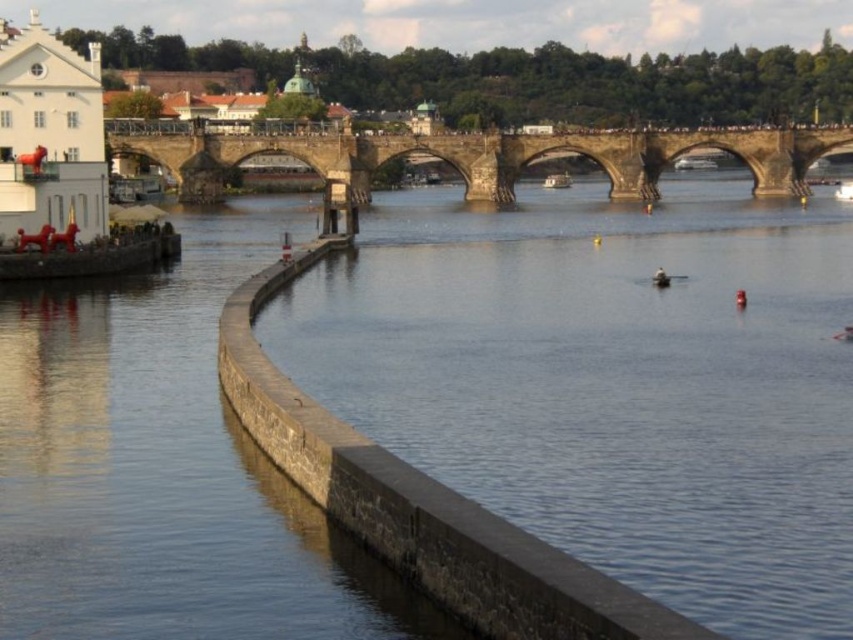
You are standing at point (x=485, y=157) in the image. What is located at this point?

The point (x=485, y=157) is located at the stone bridge at center.

You are a tourist standing on the Charles Bridge and see both the white plastic boat at center and the smooth wooden boat at center floating on the Vltava River. Which boat is closer to you?

The white plastic boat at center is closer to you because the smooth wooden boat at center is positioned behind it.

From the picture: You are standing at the Charles Bridge in Prague and want to take a photo of both the point at coordinates point (303, 134) and the point at coordinates point (554, 179). Which point will appear larger in your camera view?

Point (303, 134) is closer to the viewer than point (554, 179), so it will appear larger in the camera view.